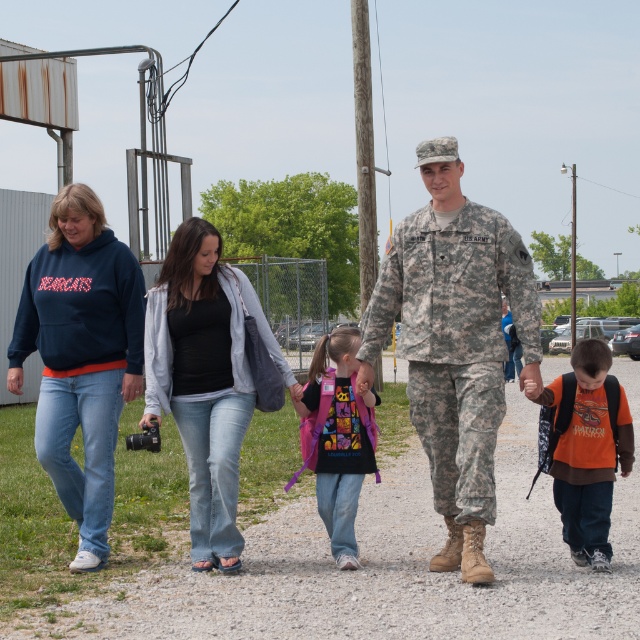
What is the relationship between the camouflage fabric uniform at center and the camouflage uniform at center?

The camouflage fabric uniform at center is located below the camouflage uniform at center.

You are a photographer trying to capture a photo of the denim jeans at center and the orange cotton shirt at lower right. Which object should you focus on first if you want to include both in the frame without moving the camera?

You should focus on the denim jeans at center first since it is positioned to the left of the orange cotton shirt at lower right, allowing both to be captured in the frame by centering the camera between them.